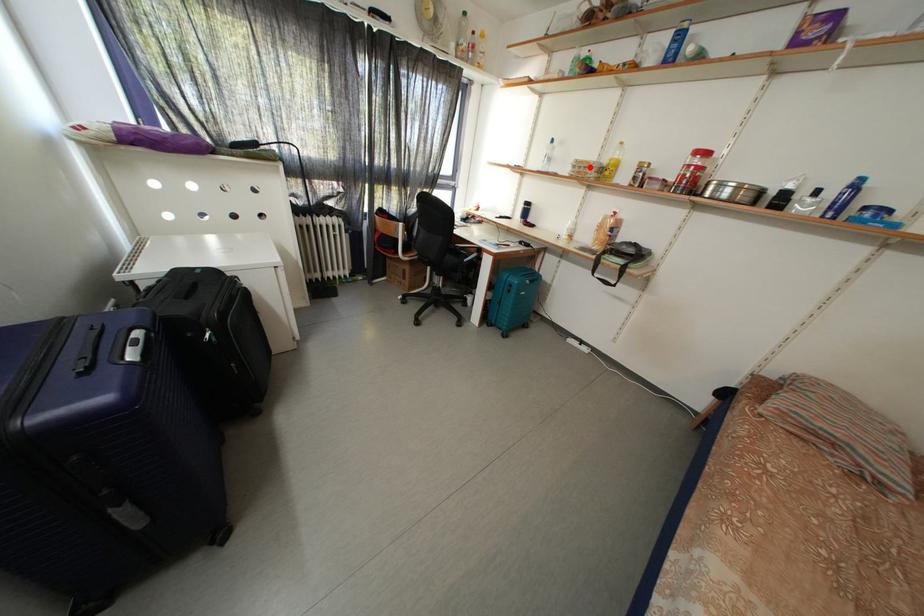
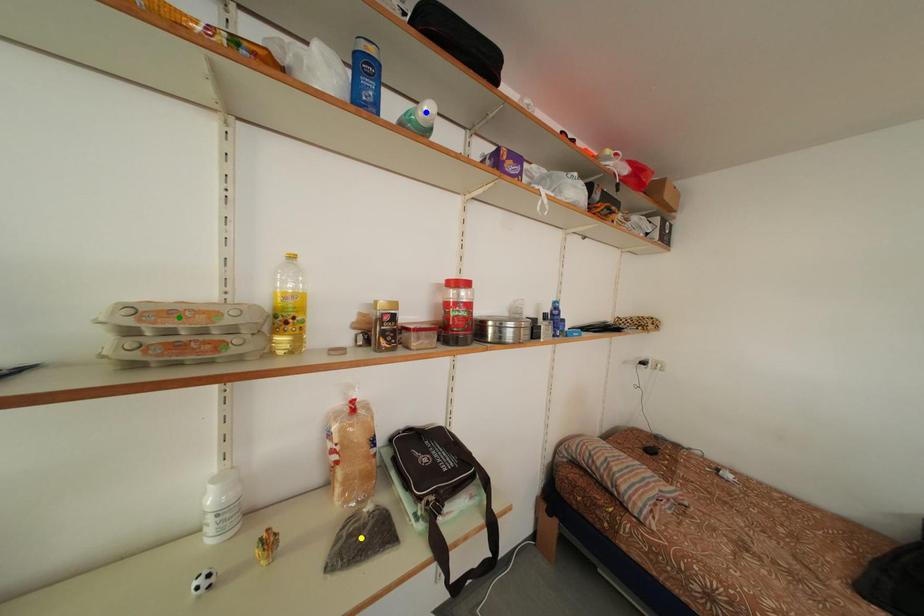
Question: I am providing you with two images of the same scene from different viewpoints. A red point is marked on the first image. You are given multiple points on the second image. Which spot in image 2 lines up with the point in image 1?

Choices:
 (A) blue point
 (B) yellow point
 (C) green point

Answer: (C)